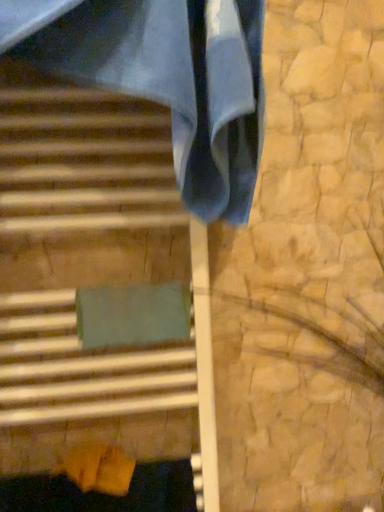
Question: Should I look upward or downward to see matte green cushion at center?

Choices:
 (A) down
 (B) up

Answer: (A)